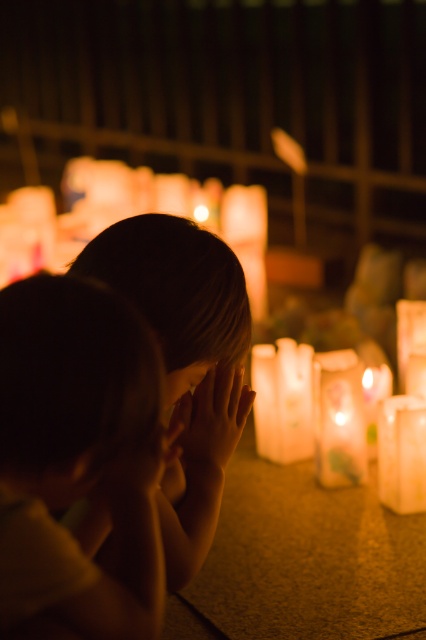
Can you confirm if matte skin hand at center is taller than smooth skin face at center?

Indeed, matte skin hand at center has a greater height compared to smooth skin face at center.

Image resolution: width=426 pixels, height=640 pixels. Describe the element at coordinates (213, 417) in the screenshot. I see `matte skin hand at center` at that location.

Which is behind, point (226, 456) or point (189, 372)?

Positioned behind is point (226, 456).

Where is `matte skin hand at center`? The width and height of the screenshot is (426, 640). matte skin hand at center is located at coordinates (213, 417).

Can you confirm if silky yellow shirt at lower left is positioned below matte skin hand at center?

Yes.

Consider the image. Can you confirm if silky yellow shirt at lower left is wider than matte skin hand at center?

Yes, silky yellow shirt at lower left is wider than matte skin hand at center.

Which is in front, point (5, 294) or point (235, 397)?

Positioned in front is point (5, 294).

Locate an element on the screen. This screenshot has height=640, width=426. silky yellow shirt at lower left is located at coordinates (86, 440).

Is silky yellow shirt at lower left positioned before smooth skin face at center?

Yes, silky yellow shirt at lower left is in front of smooth skin face at center.

Can you confirm if silky yellow shirt at lower left is taller than smooth skin face at center?

Correct, silky yellow shirt at lower left is much taller as smooth skin face at center.

Which is in front, point (58, 458) or point (181, 387)?

Positioned in front is point (58, 458).

Locate an element on the screen. silky yellow shirt at lower left is located at coordinates (86, 440).